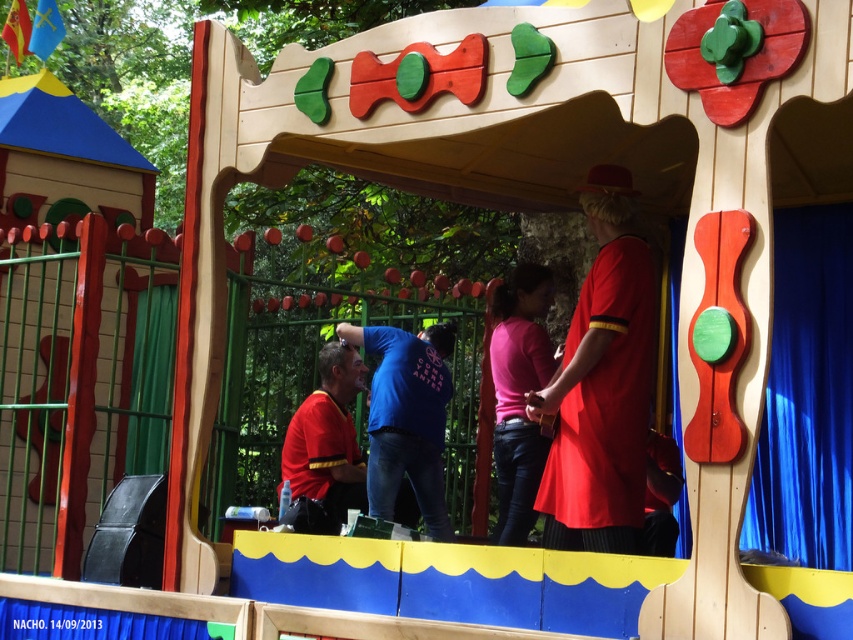
You are a photographer at the event and want to capture both the blue cotton shirt at center and the matte red shirt at center in a single frame. Which shirt should you focus on to ensure both are visible without zooming in or out?

The blue cotton shirt at center is bigger than the matte red shirt at center, so focusing on the blue cotton shirt at center will ensure both are visible without needing to adjust the zoom.